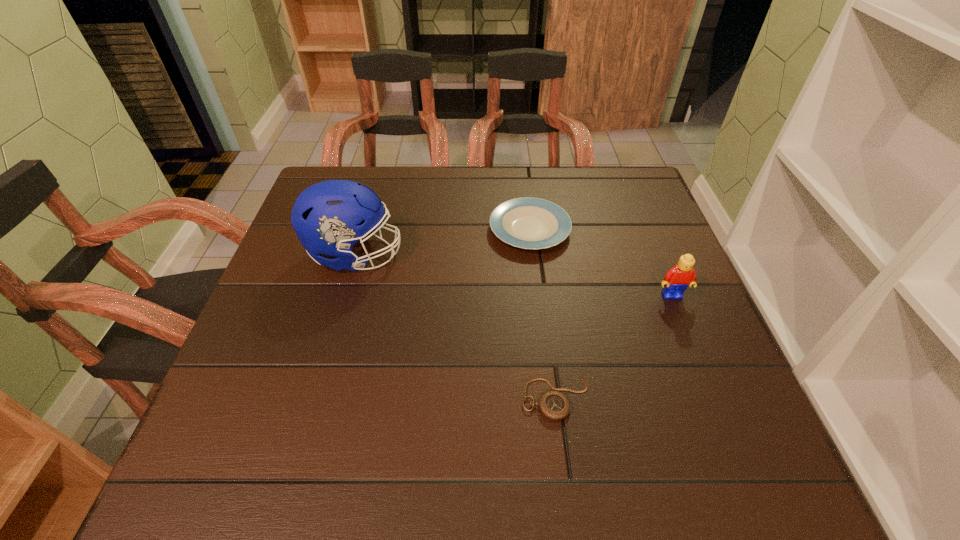
Identify the location of the tallest object. 330,217.

The image size is (960, 540). I want to click on the leftmost object, so point(330,217).

This screenshot has width=960, height=540. What are the coordinates of `the rightmost object` in the screenshot? It's located at (682, 275).

The width and height of the screenshot is (960, 540). Identify the location of Lego. (682, 275).

I want to click on plate, so click(x=530, y=223).

This screenshot has width=960, height=540. I want to click on the shortest object, so click(553, 405).

I want to click on pocket watch, so click(x=553, y=405).

You are a GUI agent. You are given a task and a screenshot of the screen. Output one action in this format:
    pyautogui.click(x=<x>, y=<y>)
    Task: Click on the vacant space located on the face guard of the leftmost object
    This screenshot has width=960, height=540.
    Given the screenshot: What is the action you would take?
    pyautogui.click(x=527, y=255)

The height and width of the screenshot is (540, 960). I want to click on free space located on the front-facing side of the third farthest object, so click(697, 358).

Where is `vacant space located 0.330m on the left of the plate`? This screenshot has height=540, width=960. vacant space located 0.330m on the left of the plate is located at coordinates pos(362,230).